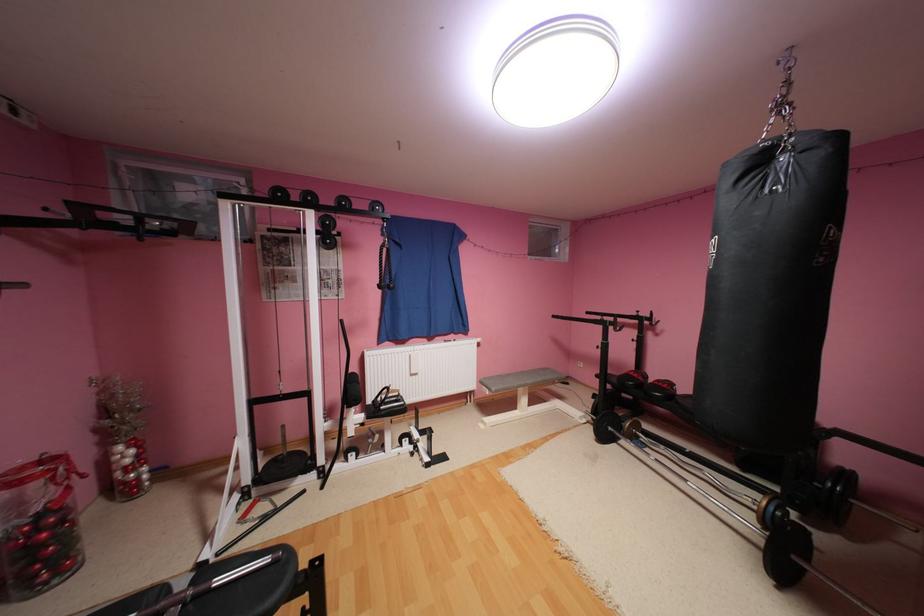
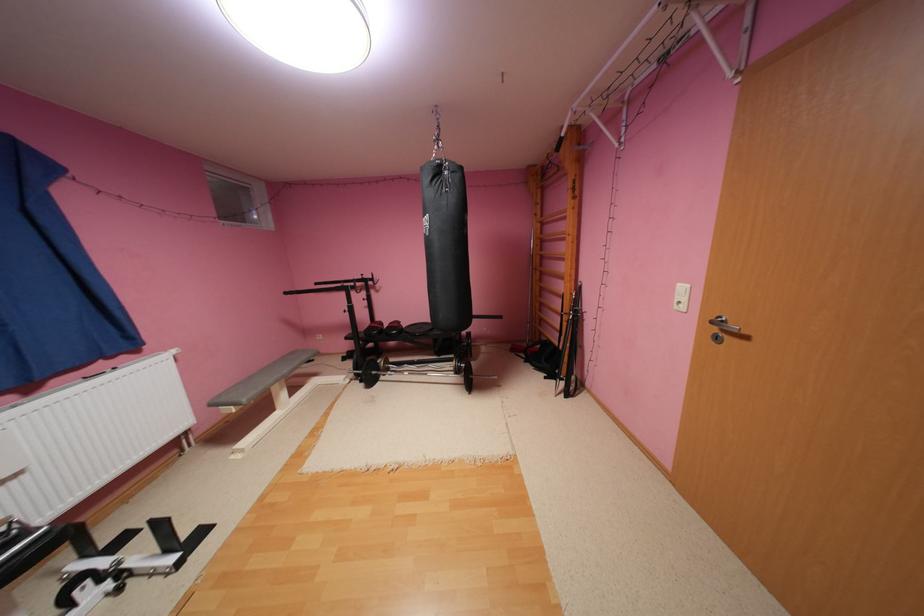
The point at (420, 375) is marked in the first image. Where is the corresponding point in the second image?

(11, 483)